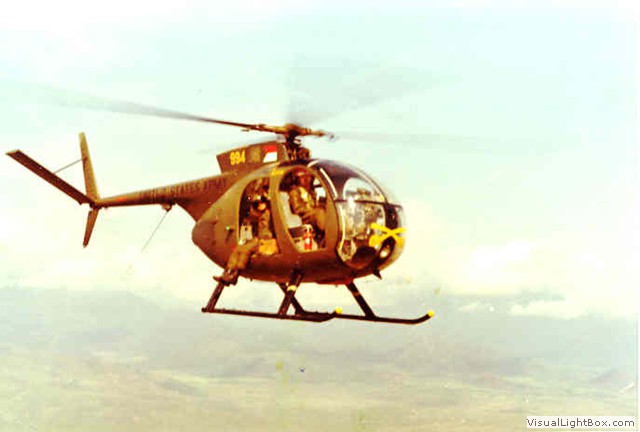
You are a GUI agent. You are given a task and a screenshot of the screen. Output one action in this format:
    pyautogui.click(x=<x>, y=<y>)
    Task: Click on the fire extinguisher
    
    Given the screenshot: What is the action you would take?
    pyautogui.click(x=306, y=241)